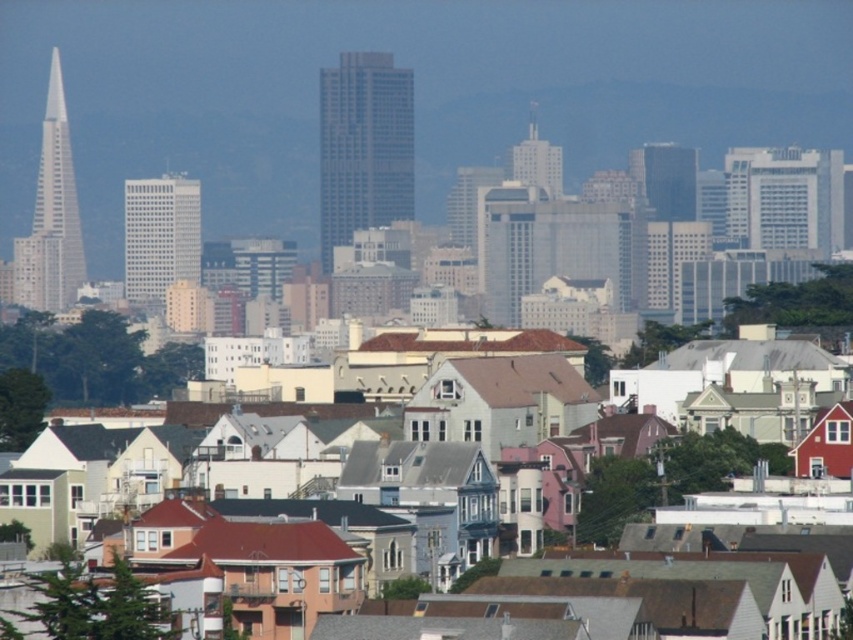
You are a drone operator planning to fly a drone between the smooth glass skyscraper at center and the white glass spire at left. The drone has a maximum flight distance of 60 meters. Can the drone safely travel between these two buildings without exceeding its range?

The smooth glass skyscraper at center is 59.21 meters away from the white glass spire at left. Since the drone has a maximum flight distance of 60 meters, it can safely travel between them without exceeding its range.

You are an architect analyzing the cityscape. You need to determine which of the two buildings, the smooth glass skyscraper at center or the white glass spire at left, has a greater height. Based on the provided information, which building is taller?

The white glass spire at left is taller than the smooth glass skyscraper at center.

You are standing at the point marked by the coordinate point at point (363, 147). Looking around, you see the smooth glass skyscraper at center. What is the name of the building you are standing at?

The smooth glass skyscraper at center is located at point (363, 147), so the building you are standing at is the smooth glass skyscraper at center.